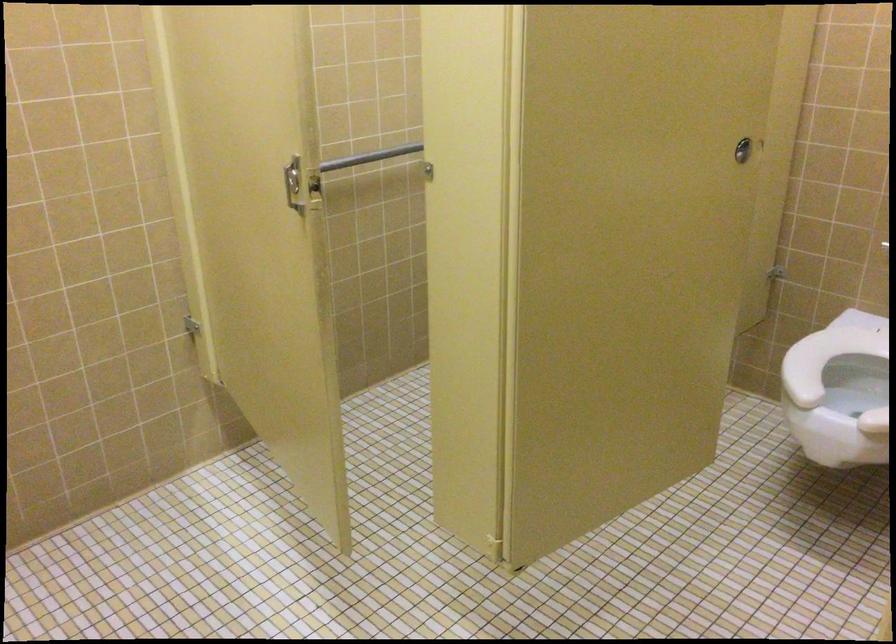
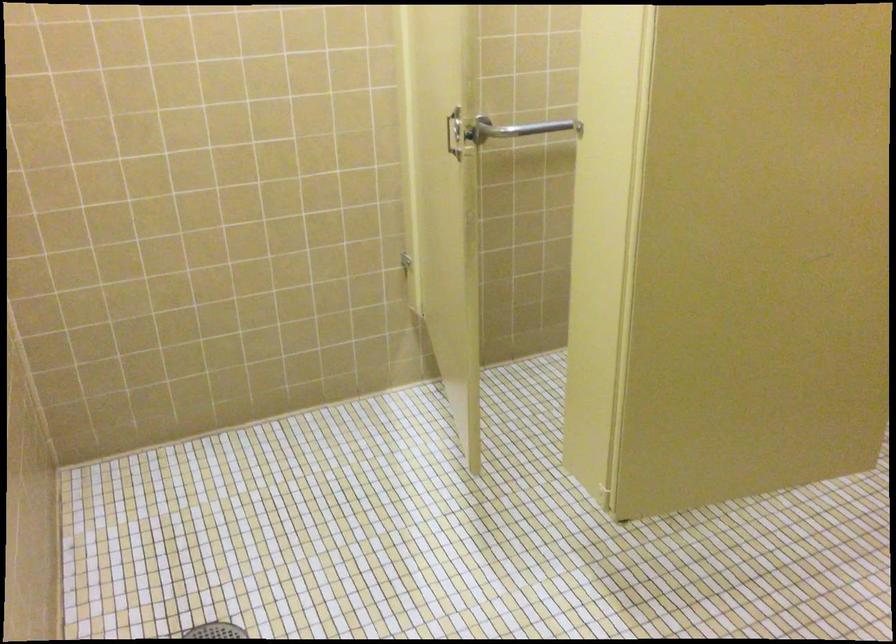
Find the pixel in the second image that matches (x=369, y=156) in the first image.

(590, 122)